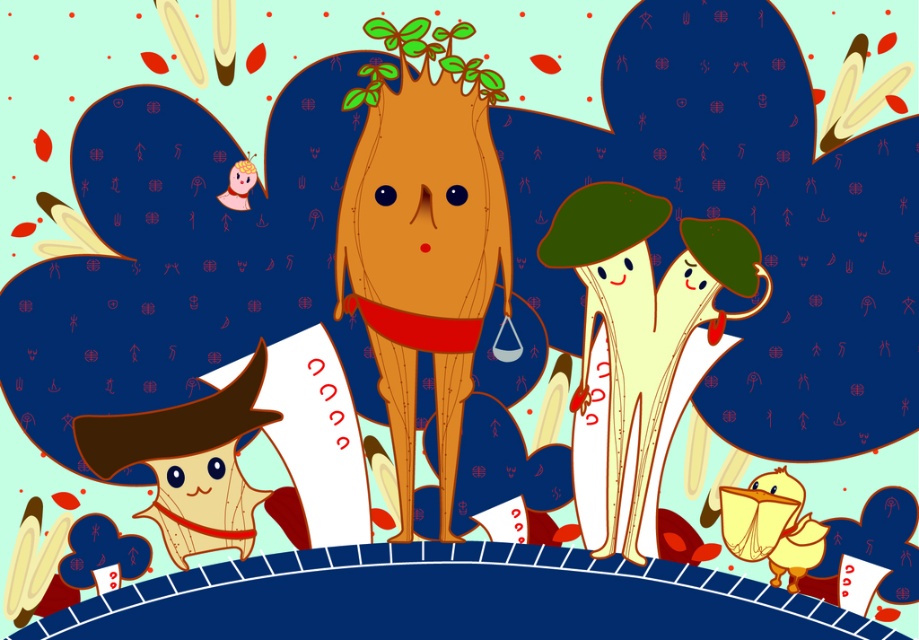
Is point (410, 326) positioned before point (616, 244)?

No, it is behind (616, 244).

What do you see at coordinates (423, 241) in the screenshot?
I see `smooth brown tree trunk at center` at bounding box center [423, 241].

Identify the location of smooth brown tree trunk at center. (423, 241).

Image resolution: width=919 pixels, height=640 pixels. In order to click on smooth brown tree trunk at center in this screenshot , I will do point(423,241).